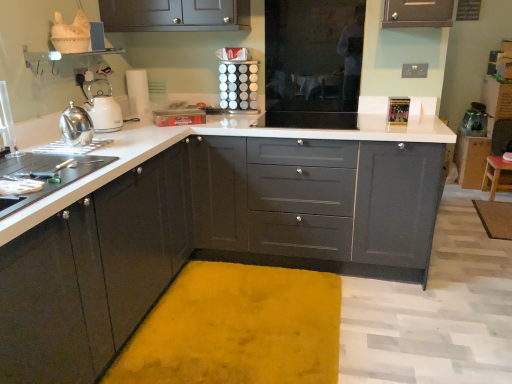
The image size is (512, 384). Find the location of `vacant space positioned to the left of wooden stool at lower right`. vacant space positioned to the left of wooden stool at lower right is located at coordinates (471, 193).